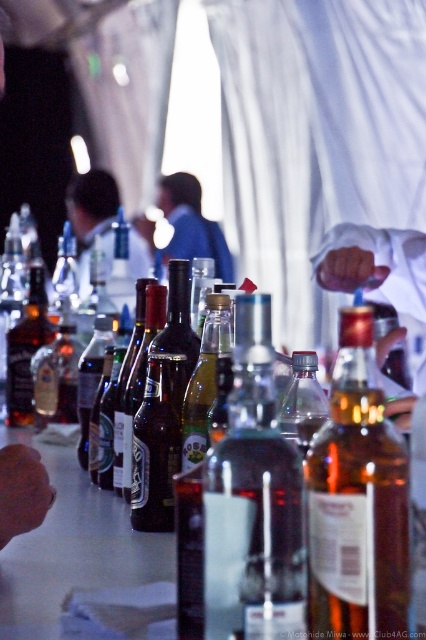
Can you confirm if brown glass bottle at center is positioned to the right of translucent glass beer bottle at center?

Indeed, brown glass bottle at center is positioned on the right side of translucent glass beer bottle at center.

Who is more forward, (149,460) or (89,412)?

Point (149,460) is in front.

Does point (140, 464) come behind point (89, 355)?

No, (140, 464) is closer to viewer.

At what (x,y) coordinates should I click in order to perform the action: click on brown glass bottle at center. Please return your answer as a coordinate pair (x, y). Looking at the image, I should click on (157, 444).

What are the coordinates of `clear glass bottle at center` in the screenshot? It's located at coord(253,516).

Describe the element at coordinates (253, 516) in the screenshot. This screenshot has width=426, height=640. I see `clear glass bottle at center` at that location.

I want to click on clear glass bottle at center, so click(x=253, y=516).

Between clear glass bottle at center and matte black shirt at center, which one has more height?

With more height is matte black shirt at center.

The image size is (426, 640). Identify the location of clear glass bottle at center. (253, 516).

Image resolution: width=426 pixels, height=640 pixels. I want to click on clear glass bottle at center, so click(253, 516).